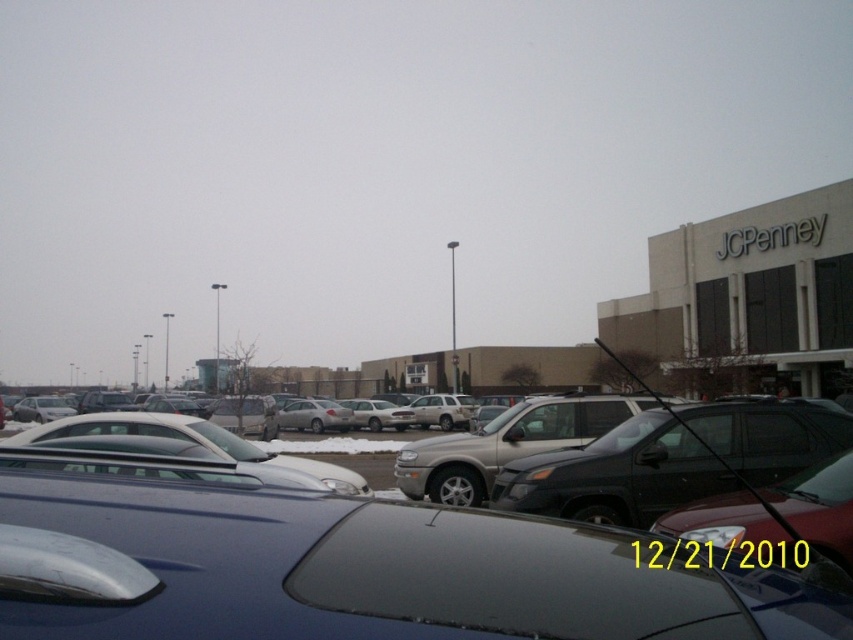
Question: Which is farther from the shiny silver sedan at center?

Choices:
 (A) satin black suv at center
 (B) satin silver suv at center

Answer: (B)

Question: Which of the following is the closest to the observer?

Choices:
 (A) (469, 445)
 (B) (519, 557)
 (C) (663, 502)

Answer: (B)

Question: Does satin black suv at center appear on the right side of satin silver suv at center?

Choices:
 (A) no
 (B) yes

Answer: (B)

Question: Which point is farther to the camera?

Choices:
 (A) (316, 598)
 (B) (560, 456)

Answer: (B)

Question: Does satin black suv at center lie behind satin silver suv at center?

Choices:
 (A) yes
 (B) no

Answer: (B)

Question: Can you confirm if shiny silver sedan at center is smaller than satin black suv at center?

Choices:
 (A) no
 (B) yes

Answer: (B)